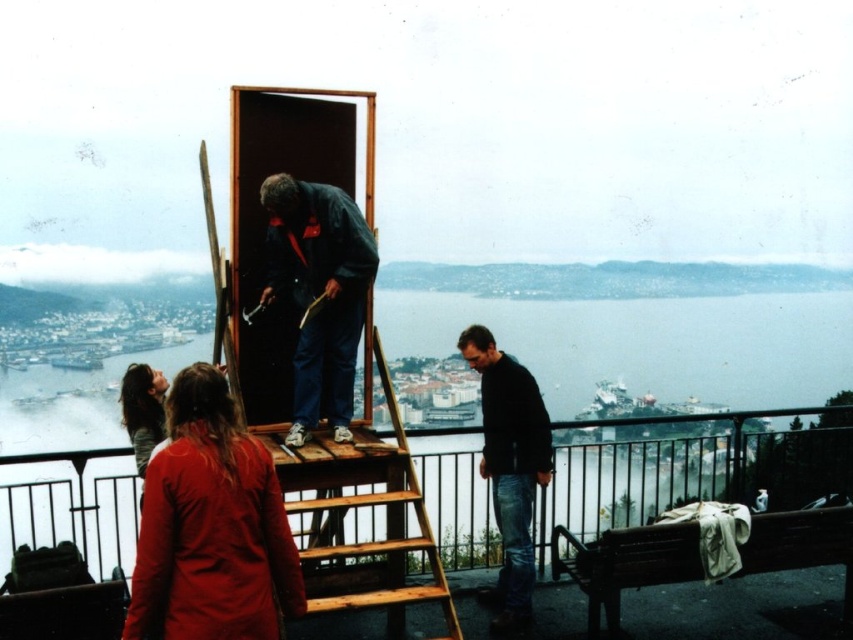
Question: From the image, what is the correct spatial relationship of red woolen sweater at lower left in relation to black sweater at center?

Choices:
 (A) left
 (B) right

Answer: (A)

Question: Which point is closer to the camera?

Choices:
 (A) (300, 428)
 (B) (148, 572)
 (C) (368, 472)
 (D) (502, 605)

Answer: (B)

Question: Among these points, which one is nearest to the camera?

Choices:
 (A) (492, 588)
 (B) (177, 573)
 (C) (132, 380)
 (D) (306, 221)

Answer: (B)

Question: Which object appears farthest from the camera in this image?

Choices:
 (A) wooden at center
 (B) long brown hair at lower left
 (C) dark blue fabric jacket at center
 (D) red woolen sweater at lower left

Answer: (B)

Question: Is wooden at center to the left of long brown hair at lower left from the viewer's perspective?

Choices:
 (A) yes
 (B) no

Answer: (B)

Question: Is wooden at center wider than black sweater at center?

Choices:
 (A) no
 (B) yes

Answer: (B)